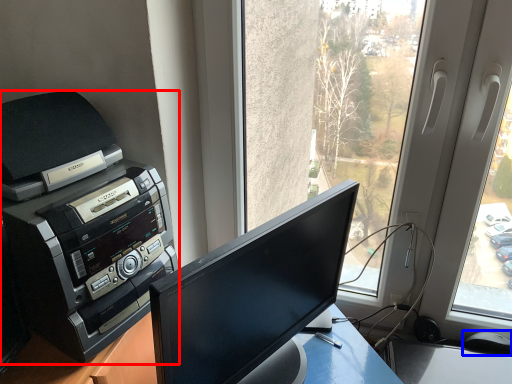
Question: Which object appears farthest to the camera in this image, printer (highlighted by a red box) or mouse (highlighted by a blue box)?

Choices:
 (A) printer
 (B) mouse

Answer: (B)